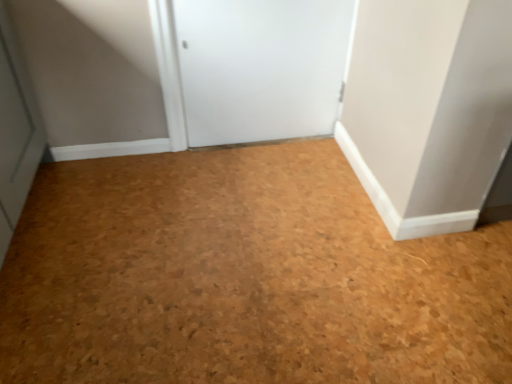
Locate an element on the screen. The image size is (512, 384). vacant point to the right of white matte door at center is located at coordinates coord(310,155).